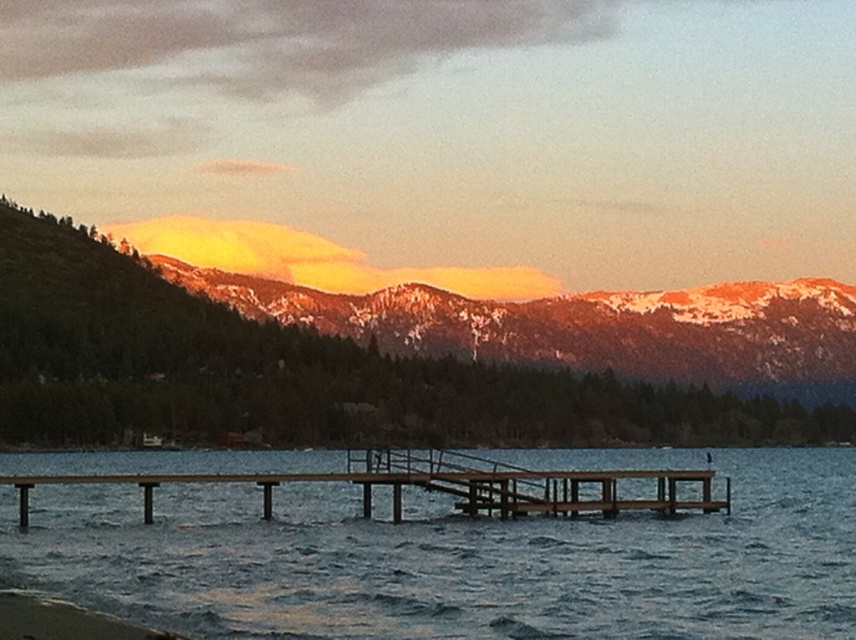
Which is below, smooth blue water at center or smooth sand at lower left?

smooth blue water at center is below.

Based on the photo, who is positioned more to the right, smooth blue water at center or smooth sand at lower left?

Positioned to the right is smooth blue water at center.

Find the location of `smooth blue water at center`. smooth blue water at center is located at coordinates (455, 561).

Which is in front, point (224, 401) or point (51, 600)?

Point (51, 600) is in front.

Is sandy brown mountains at upper center further to camera compared to smooth sand at lower left?

Yes, sandy brown mountains at upper center is behind smooth sand at lower left.

Describe the element at coordinates (301, 374) in the screenshot. Image resolution: width=856 pixels, height=640 pixels. I see `sandy brown mountains at upper center` at that location.

This screenshot has width=856, height=640. Identify the location of sandy brown mountains at upper center. (301, 374).

This screenshot has width=856, height=640. Describe the element at coordinates (443, 488) in the screenshot. I see `wooden dock at center` at that location.

Can you confirm if wooden dock at center is positioned to the left of smooth sand at lower left?

Indeed, wooden dock at center is positioned on the left side of smooth sand at lower left.

Where is `wooden dock at center`? wooden dock at center is located at coordinates (443, 488).

Find the location of `wooden dock at center`. wooden dock at center is located at coordinates (443, 488).